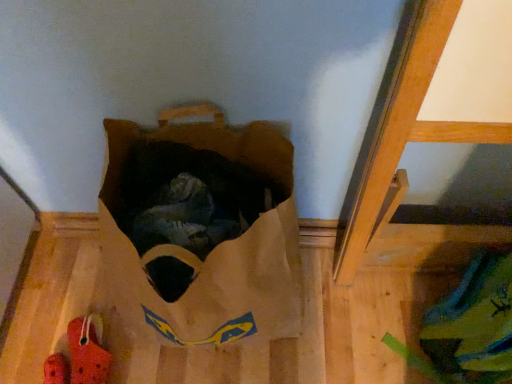
Locate an element on the screen. free space to the left of brown paper bag at upper center is located at coordinates (56, 288).